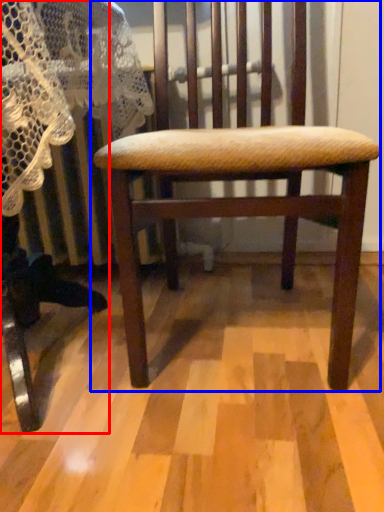
Question: Among these objects, which one is farthest to the camera, rocking chair (highlighted by a red box) or chair (highlighted by a blue box)?

Choices:
 (A) rocking chair
 (B) chair

Answer: (B)